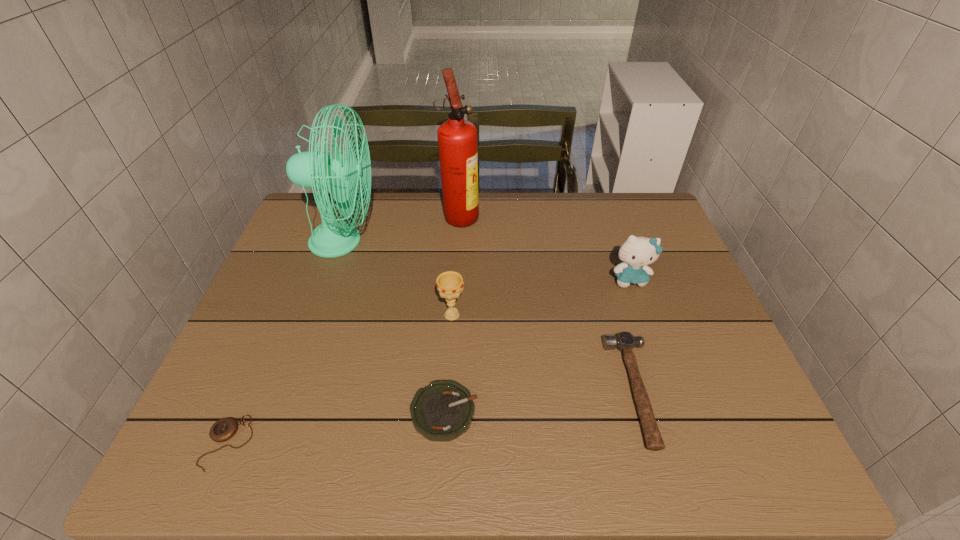
Find the location of a particular element. The width and height of the screenshot is (960, 540). free region at the right edge of the desktop is located at coordinates (709, 353).

Identify the location of free region at the far left corner of the desktop. (337, 217).

You are a GUI agent. You are given a task and a screenshot of the screen. Output one action in this format:
    pyautogui.click(x=<x>, y=<y>)
    Task: Click on the free space at the near left corner
    This screenshot has height=540, width=960.
    Given the screenshot: What is the action you would take?
    pyautogui.click(x=211, y=464)

What are the coordinates of `vacant space at the far right corner of the desktop` in the screenshot? It's located at (656, 207).

You are a GUI agent. You are given a task and a screenshot of the screen. Output one action in this format:
    pyautogui.click(x=<x>, y=<y>)
    Task: Click on the vacant space that's between the fan and the fire extinguisher
    
    Given the screenshot: What is the action you would take?
    pyautogui.click(x=401, y=228)

Where is `unoccupied area between the ashtray and the fan`? This screenshot has width=960, height=540. unoccupied area between the ashtray and the fan is located at coordinates (394, 327).

Where is `free space between the fourth nearest object and the hammer`? free space between the fourth nearest object and the hammer is located at coordinates (543, 353).

You are a GUI agent. You are given a task and a screenshot of the screen. Output one action in this format:
    pyautogui.click(x=<x>, y=<y>)
    Task: Click on the free space between the fire extinguisher and the pocket watch
    
    Given the screenshot: What is the action you would take?
    pyautogui.click(x=344, y=329)

Locate an element on the screen. This screenshot has height=540, width=960. vacant region between the fire extinguisher and the pocket watch is located at coordinates (344, 329).

Locate an element on the screen. The width and height of the screenshot is (960, 540). empty location between the sixth tallest object and the kitten is located at coordinates (538, 346).